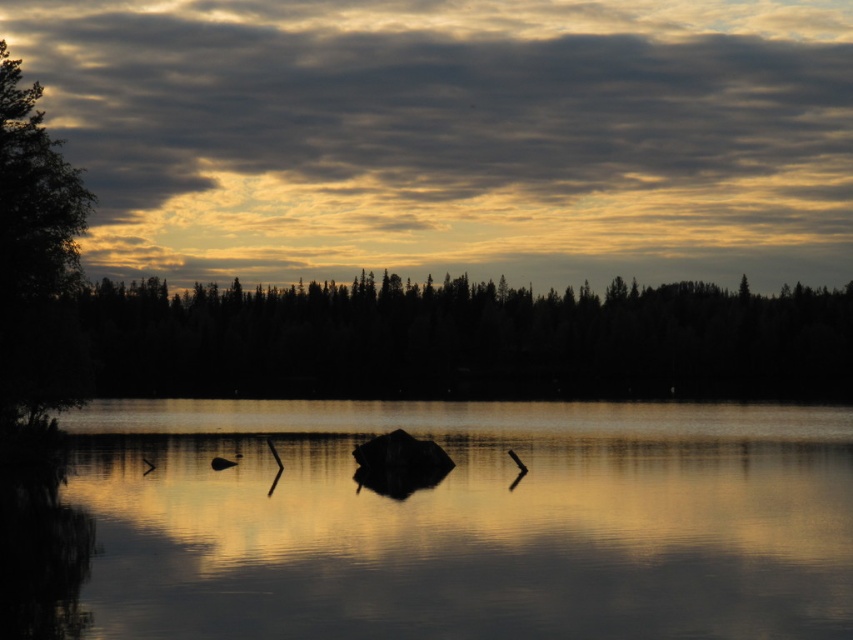
Question: Which point appears farthest from the camera in this image?

Choices:
 (A) (164, 628)
 (B) (251, 236)

Answer: (B)

Question: Does cloudy sky at upper center appear on the right side of smooth water at center?

Choices:
 (A) yes
 (B) no

Answer: (B)

Question: Can you confirm if smooth water at center is thinner than silhouette/texture trees at center?

Choices:
 (A) yes
 (B) no

Answer: (A)

Question: Which of these objects is positioned closest to the smooth water at center?

Choices:
 (A) silhouette/texture trees at center
 (B) green leafy tree at left
 (C) cloudy sky at upper center

Answer: (B)

Question: Is cloudy sky at upper center below green leafy tree at left?

Choices:
 (A) yes
 (B) no

Answer: (B)

Question: Which point is farther to the camera?

Choices:
 (A) (32, 292)
 (B) (509, 612)

Answer: (A)